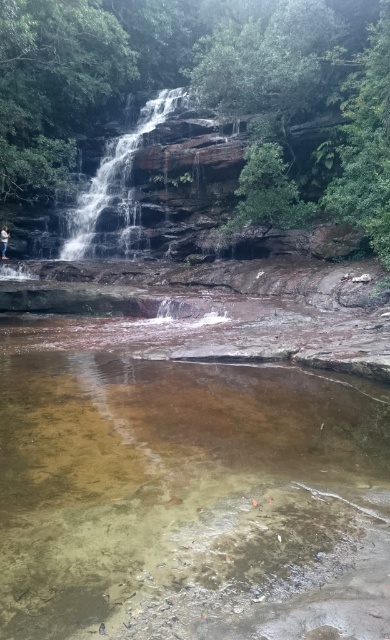
You are standing at the edge of the pool and want to place your white cotton shirt at lower left on top of the smooth brown rock at center. Based on their sizes, will the shirt fit entirely on the rock?

The smooth brown rock at center has a larger size compared to white cotton shirt at lower left, so the shirt will fit entirely on the rock.

You are standing at the edge of the pool and see the clear water at center and the white cotton shirt at lower left. Which object is shorter in height?

The clear water at center has a lesser height compared to the white cotton shirt at lower left, so the clear water at center is shorter in height.

You are standing at the edge of the pool and want to step onto the smooth brown rock at center. Based on the scene, can you safely step onto it from the clear water at center?

The clear water at center is in front of the smooth brown rock at center, so stepping onto the rock would require moving forward from the water, which is possible as long as the rock is stable and dry enough. However, caution is advised due to the slippery conditions caused by the waterfall mist.